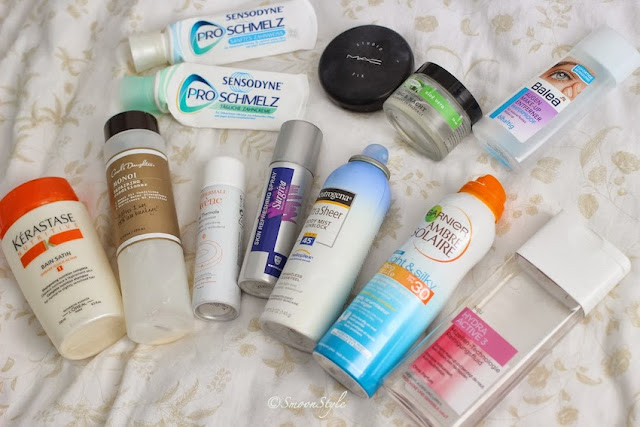
Identify the location of spray bottle. The width and height of the screenshot is (640, 427). (509, 316).